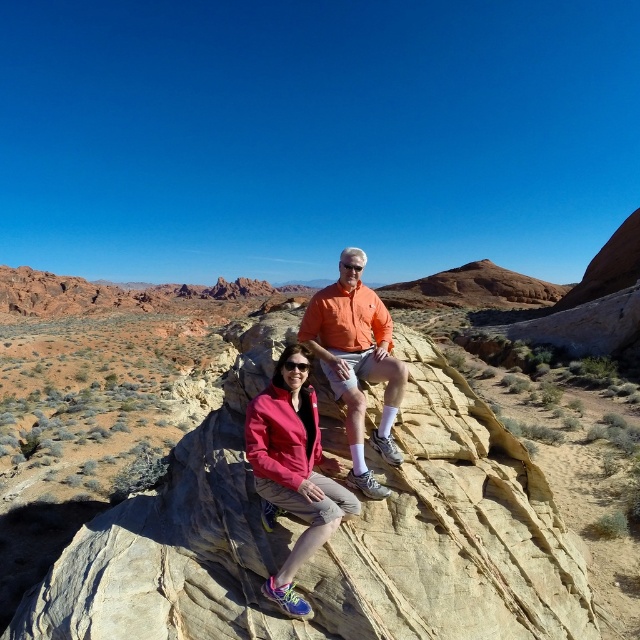
Question: Is smooth sandstone rock at center thinner than orange cotton shirt at center?

Choices:
 (A) yes
 (B) no

Answer: (B)

Question: Which of the following is the farthest from the observer?

Choices:
 (A) [x=326, y=326]
 (B) [x=264, y=502]

Answer: (A)

Question: Can you confirm if smooth sandstone rock at center is positioned below orange cotton shirt at center?

Choices:
 (A) no
 (B) yes

Answer: (B)

Question: Which point is closer to the camera?

Choices:
 (A) (150, 628)
 (B) (339, 298)
 (C) (298, 428)

Answer: (A)

Question: Which of the following is the farthest from the observer?

Choices:
 (A) (369, 362)
 (B) (83, 595)

Answer: (A)

Question: Does smooth sandstone rock at center have a lesser width compared to orange cotton shirt at center?

Choices:
 (A) no
 (B) yes

Answer: (A)